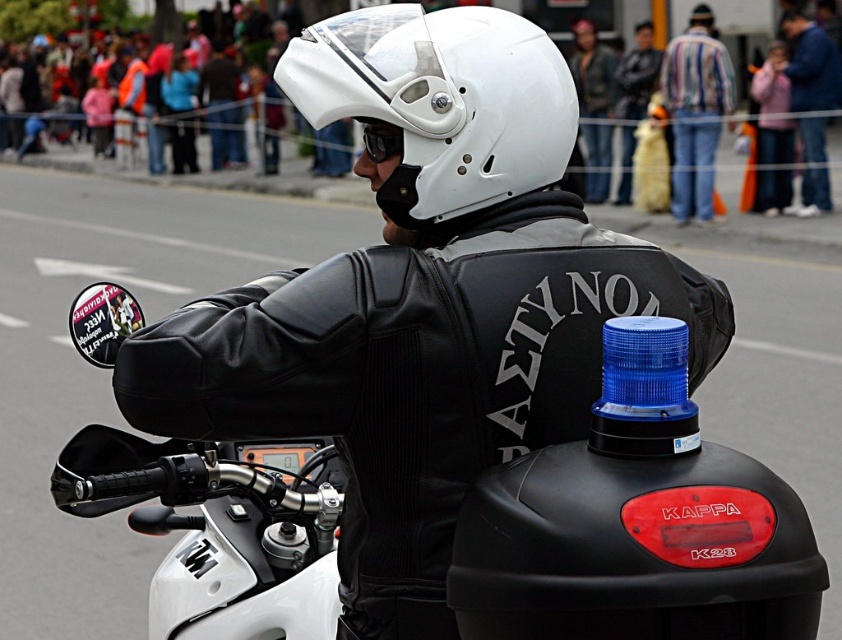
Question: Which object appears farthest from the camera in this image?

Choices:
 (A) white matte helmet at center
 (B) black matte goggles at center

Answer: (B)

Question: Among these objects, which one is nearest to the camera?

Choices:
 (A) matte black jacket at center
 (B) striped shirt at center

Answer: (A)

Question: Is matte black jacket at center above black matte goggles at center?

Choices:
 (A) no
 (B) yes

Answer: (A)

Question: Does matte black jacket at center come behind blue denim jacket at upper right?

Choices:
 (A) yes
 (B) no

Answer: (B)

Question: Which of these objects is positioned farthest from the matte black jacket at center?

Choices:
 (A) blue denim jacket at upper right
 (B) striped shirt at center

Answer: (A)

Question: Is striped shirt at center thinner than black matte goggles at center?

Choices:
 (A) no
 (B) yes

Answer: (A)